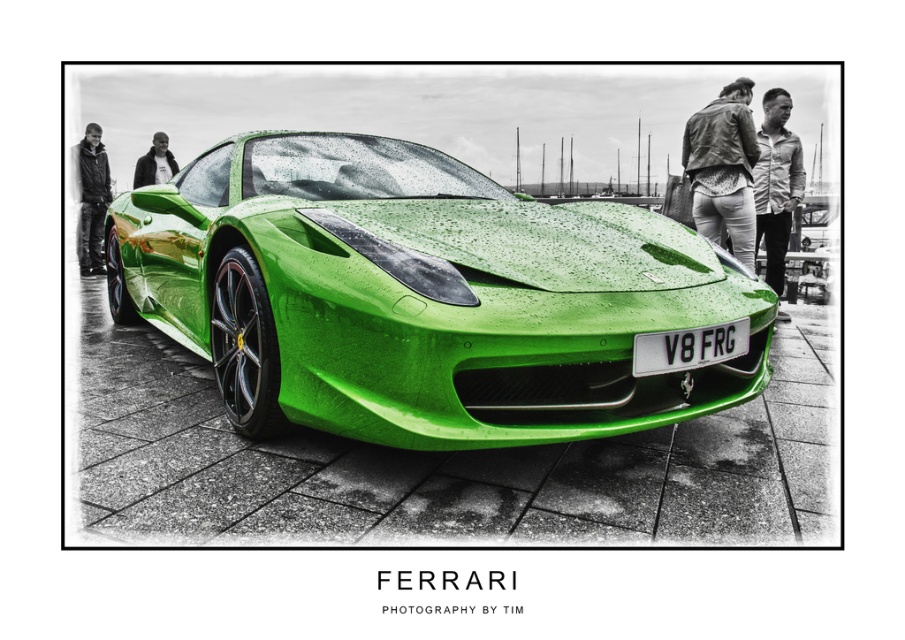
You are a photographer trying to capture a clear shot of the leather jacket at upper center and the matte black jacket at upper left. Since the background is monochrome, you want to ensure both jackets are visible. Which jacket might be more obscured in the photo due to its position?

The matte black jacket at upper left might be more obscured in the photo because the leather jacket at upper center is in front of it, potentially blocking part of the matte black jacket at upper left from view.

You are a delivery person needing to place a package on the black plastic license plate at center. The package is 2 meters long. Can you place it without it overlapping the black leather jacket at left?

The distance between the black plastic license plate at center and the black leather jacket at left is 7.61 meters. Since the package is only 2 meters long, there is sufficient space to place it on the license plate without overlapping the jacket.